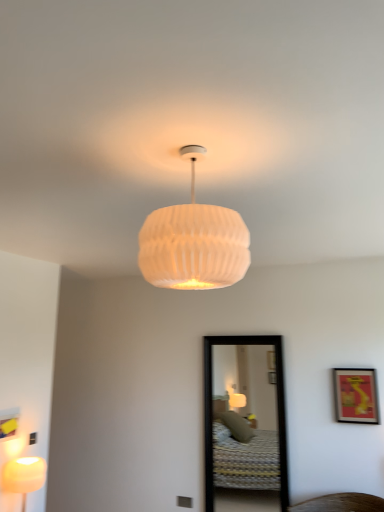
Question: From the image's perspective, is matte white lamp at lower left, marked as the 1th lamp in a back-to-front arrangement, above or below white ribbed shade at center, which is counted as the second lamp, starting from the bottom?

Choices:
 (A) below
 (B) above

Answer: (A)

Question: Considering the positions of matte white lamp at lower left, the 2th lamp when ordered from right to left, and white ribbed shade at center, positioned as the 2th lamp in left-to-right order, in the image, is matte white lamp at lower left, the 2th lamp when ordered from right to left, bigger or smaller than white ribbed shade at center, positioned as the 2th lamp in left-to-right order,?

Choices:
 (A) big
 (B) small

Answer: (B)

Question: Based on their relative distances, which object is nearer to the black-framed mirror at center?

Choices:
 (A) matte white lamp at lower left, the second lamp when ordered from front to back
 (B) matte red picture frame at right
 (C) white ribbed shade at center, positioned as the 2th lamp in left-to-right order

Answer: (B)

Question: Which object is positioned closest to the black-framed mirror at center?

Choices:
 (A) matte red picture frame at right
 (B) matte white lamp at lower left, marked as the 1th lamp in a back-to-front arrangement
 (C) white ribbed shade at center, which appears as the 1th lamp when viewed from the front

Answer: (A)